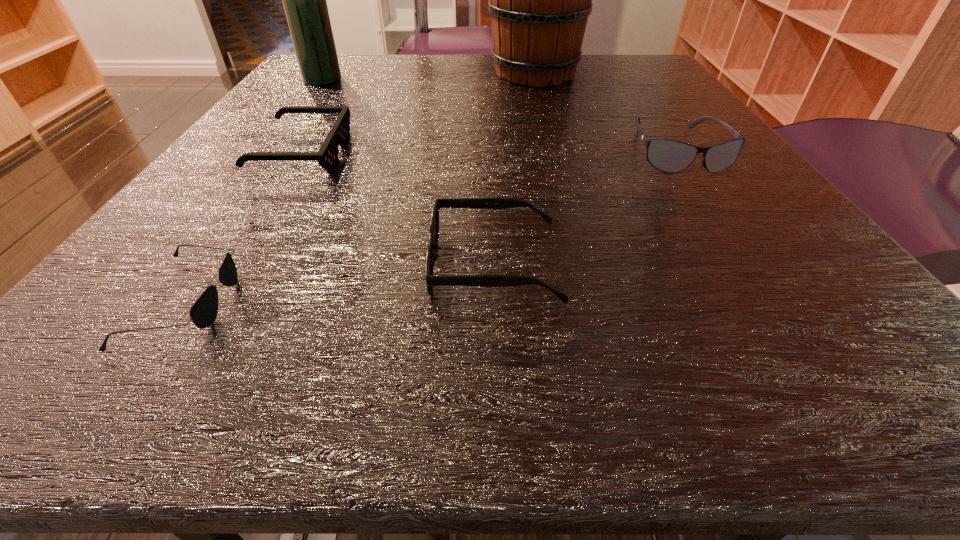
Where is `vacant space at the near edge of the desktop`? This screenshot has height=540, width=960. vacant space at the near edge of the desktop is located at coordinates [529, 366].

The width and height of the screenshot is (960, 540). Find the location of `vacant region at the left edge of the desktop`. vacant region at the left edge of the desktop is located at coordinates (201, 215).

This screenshot has height=540, width=960. Identify the location of vacant space at the right edge of the desktop. (678, 211).

The height and width of the screenshot is (540, 960). I want to click on vacant position at the far left corner of the desktop, so click(x=347, y=72).

In the image, there is a desktop. At what (x,y) coordinates should I click in order to perform the action: click on free space at the far right corner. Please return your answer as a coordinate pair (x, y). Looking at the image, I should click on (634, 84).

In the image, there is a desktop. Identify the location of free space at the near right corner. The width and height of the screenshot is (960, 540). (727, 320).

At what (x,y) coordinates should I click in order to perform the action: click on vacant space in between the third sunglasses from left to right and the shortest sunglasses. Please return your answer as a coordinate pair (x, y). Image resolution: width=960 pixels, height=540 pixels. Looking at the image, I should click on (341, 284).

This screenshot has height=540, width=960. In order to click on blank region between the wine bucket and the second sunglasses from right to left in this screenshot , I will do `click(515, 169)`.

The image size is (960, 540). I want to click on free spot between the shortest sunglasses and the third sunglasses from left to right, so 341,284.

I want to click on empty space between the shortest object and the second sunglasses from right to left, so click(341, 284).